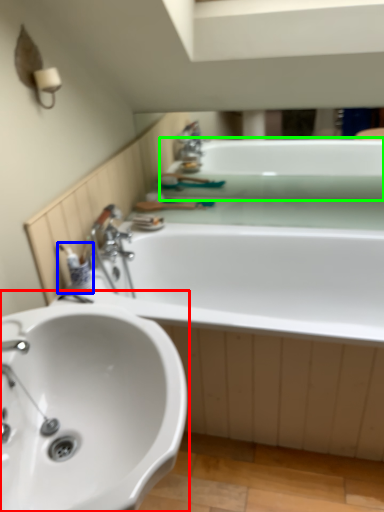
Question: Based on their relative distances, which object is nearer to sink (highlighted by a red box)? Choose from toiletry (highlighted by a blue box) and bath (highlighted by a green box).

Choices:
 (A) toiletry
 (B) bath

Answer: (A)